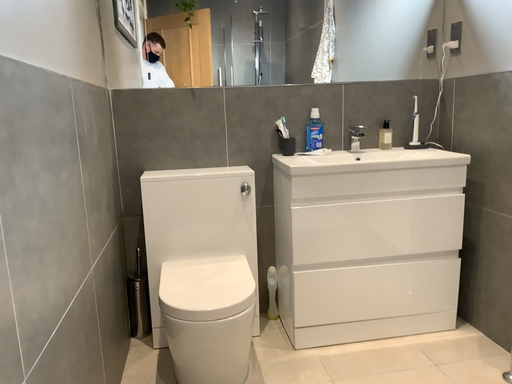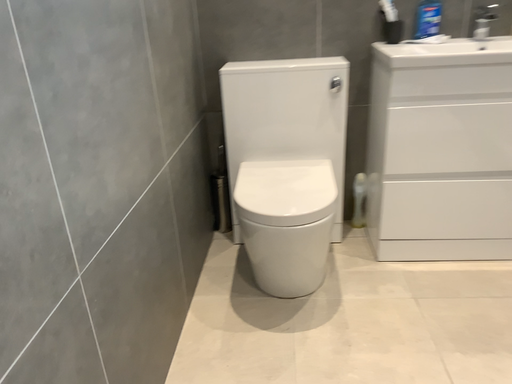
Question: How did the camera likely rotate when shooting the video?

Choices:
 (A) rotated left
 (B) rotated right

Answer: (A)